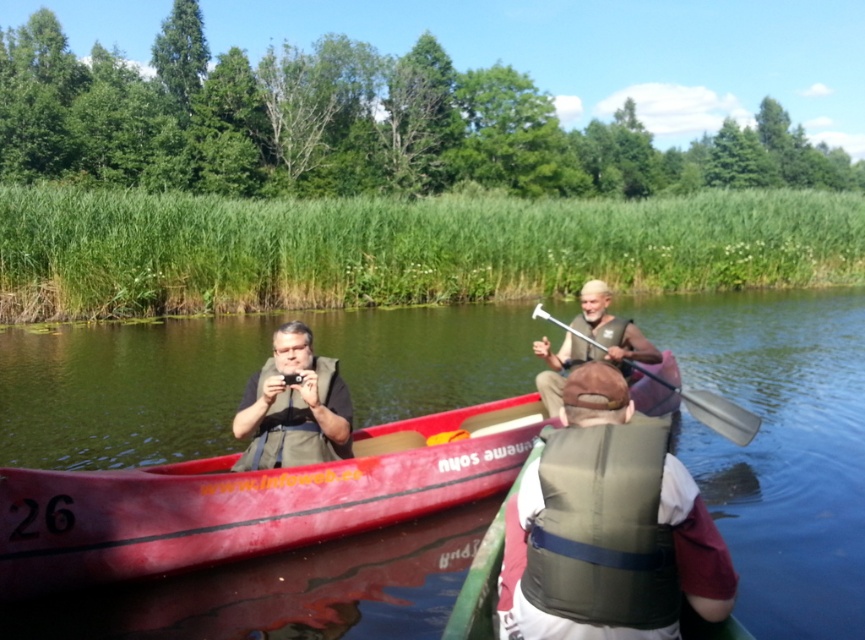
Question: From the image, what is the correct spatial relationship of green fabric life vest at center in relation to matte brown vest at center?

Choices:
 (A) below
 (B) above

Answer: (A)

Question: Can you confirm if matte black life vest at center is positioned below matte brown vest at center?

Choices:
 (A) yes
 (B) no

Answer: (A)

Question: Is red plastic canoe at center smaller than matte brown vest at center?

Choices:
 (A) yes
 (B) no

Answer: (B)

Question: Among these points, which one is farthest from the camera?

Choices:
 (A) click(x=268, y=358)
 (B) click(x=734, y=436)
 (C) click(x=543, y=392)
 (D) click(x=710, y=573)

Answer: (B)

Question: Among these points, which one is farthest from the camera?

Choices:
 (A) (239, 458)
 (B) (594, 448)
 (C) (546, 372)

Answer: (C)

Question: Which point appears closest to the camera in this image?

Choices:
 (A) (766, 404)
 (B) (582, 417)
 (C) (270, 460)
 (D) (727, 429)

Answer: (B)